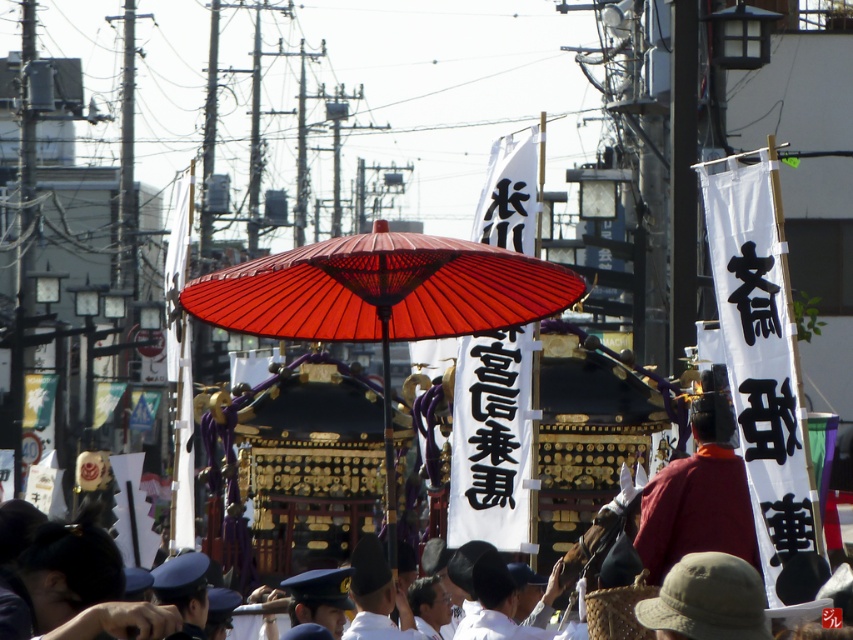
In order to click on matte red parasol at center in this screenshot , I will do `click(381, 298)`.

Between matte red parasol at center and red velvet hat at center, which one appears on the right side from the viewer's perspective?

red velvet hat at center is more to the right.

Who is more forward, (291, 301) or (741, 476)?

Point (741, 476)

Find the location of `matte red parasol at center`. matte red parasol at center is located at coordinates (381, 298).